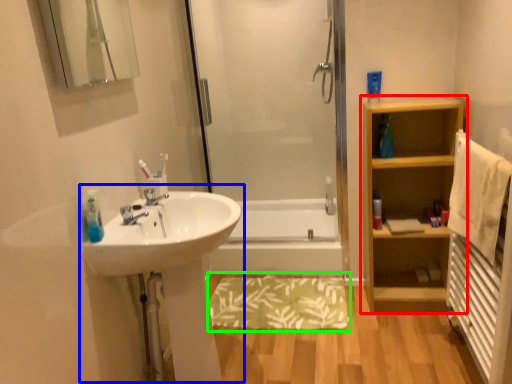
Question: Considering the real-world distances, which object is closest to bathroom cabinet (highlighted by a red box)? sink (highlighted by a blue box) or bath mat (highlighted by a green box).

Choices:
 (A) sink
 (B) bath mat

Answer: (B)